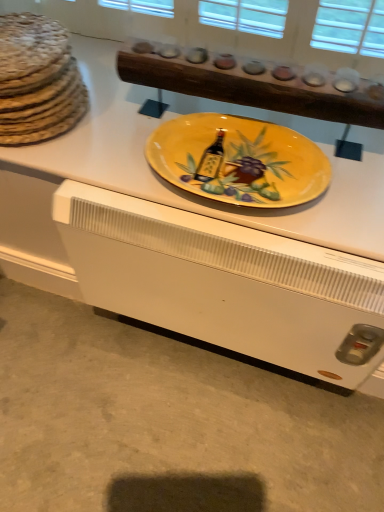
Question: Can you confirm if yellow glossy plate at center is positioned to the right of yellow ceramic plate at center?

Choices:
 (A) no
 (B) yes

Answer: (A)

Question: Does yellow glossy plate at center have a greater width compared to yellow ceramic plate at center?

Choices:
 (A) yes
 (B) no

Answer: (A)

Question: Is yellow glossy plate at center outside of yellow ceramic plate at center?

Choices:
 (A) no
 (B) yes

Answer: (B)

Question: Considering the relative sizes of yellow glossy plate at center and yellow ceramic plate at center in the image provided, is yellow glossy plate at center bigger than yellow ceramic plate at center?

Choices:
 (A) yes
 (B) no

Answer: (A)

Question: From a real-world perspective, is yellow glossy plate at center on yellow ceramic plate at center?

Choices:
 (A) no
 (B) yes

Answer: (A)

Question: Is yellow ceramic plate at center at the back of yellow glossy plate at center?

Choices:
 (A) yes
 (B) no

Answer: (B)

Question: From the image's perspective, is yellow ceramic plate at center above brown textured bread at left?

Choices:
 (A) yes
 (B) no

Answer: (B)

Question: Considering the relative positions of yellow ceramic plate at center and brown textured bread at left in the image provided, is yellow ceramic plate at center to the left of brown textured bread at left from the viewer's perspective?

Choices:
 (A) no
 (B) yes

Answer: (A)

Question: Is yellow ceramic plate at center next to brown textured bread at left and touching it?

Choices:
 (A) yes
 (B) no

Answer: (B)

Question: Considering the relative sizes of yellow ceramic plate at center and brown textured bread at left in the image provided, is yellow ceramic plate at center bigger than brown textured bread at left?

Choices:
 (A) no
 (B) yes

Answer: (A)

Question: Is there a large distance between yellow ceramic plate at center and brown textured bread at left?

Choices:
 (A) yes
 (B) no

Answer: (B)

Question: Considering the relative sizes of yellow ceramic plate at center and brown textured bread at left in the image provided, is yellow ceramic plate at center taller than brown textured bread at left?

Choices:
 (A) yes
 (B) no

Answer: (B)

Question: Can you confirm if brown textured bread at left is positioned to the right of yellow glossy plate at center?

Choices:
 (A) yes
 (B) no

Answer: (B)